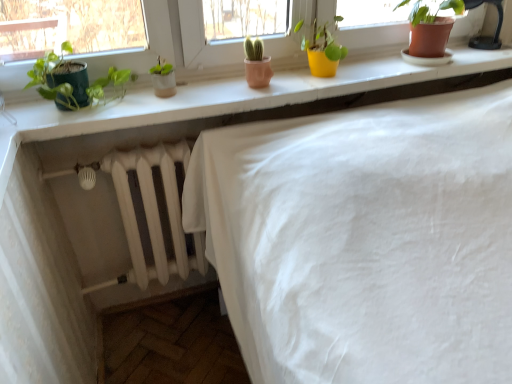
Locate an element on the screen. free region under green matte pot at left, the 1th houseplant in the left-to-right sequence (from a real-world perspective) is located at coordinates (92, 108).